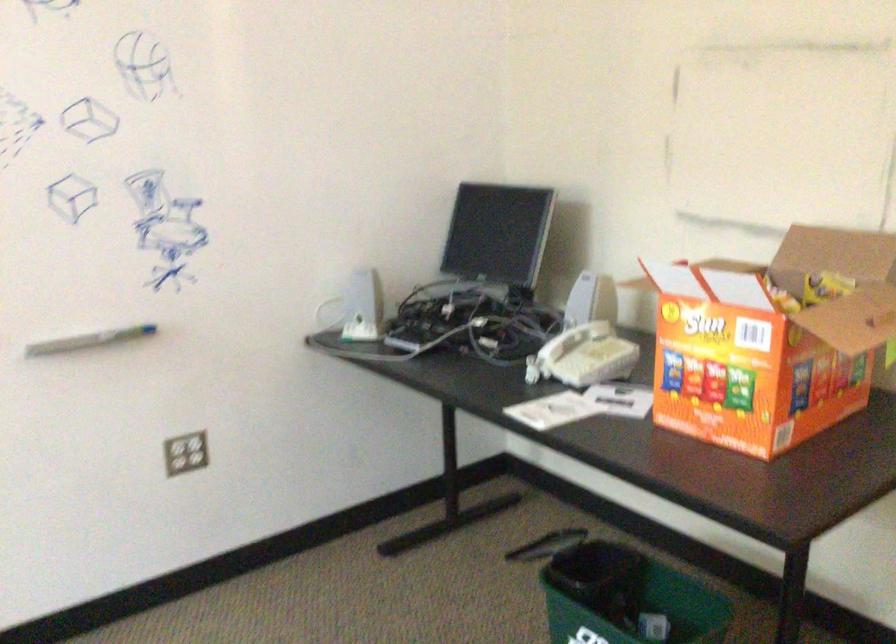
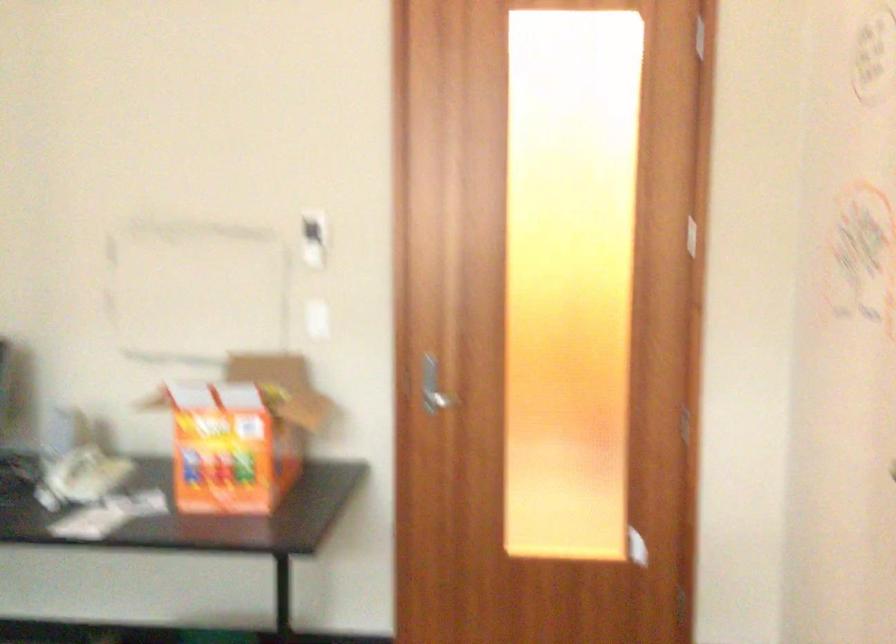
Question: The first image is from the beginning of the video and the second image is from the end. How did the camera likely rotate when shooting the video?

Choices:
 (A) Left
 (B) Right
 (C) Up
 (D) Down

Answer: (B)